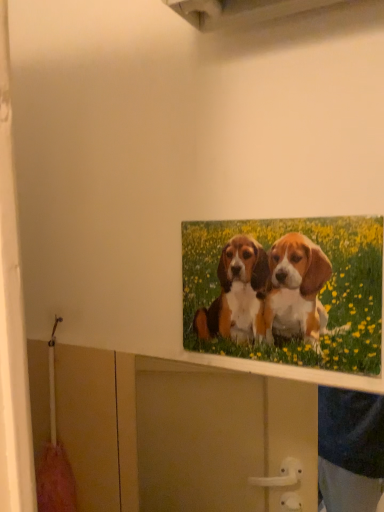
Question: Is matte white cabinet at upper center to the right of printed canvas puppies at upper center from the viewer's perspective?

Choices:
 (A) yes
 (B) no

Answer: (B)

Question: Is matte white cabinet at upper center positioned beyond the bounds of printed canvas puppies at upper center?

Choices:
 (A) no
 (B) yes

Answer: (B)

Question: From the image's perspective, is matte white cabinet at upper center under printed canvas puppies at upper center?

Choices:
 (A) yes
 (B) no

Answer: (A)

Question: Is matte white cabinet at upper center closer to camera compared to printed canvas puppies at upper center?

Choices:
 (A) yes
 (B) no

Answer: (A)

Question: Is matte white cabinet at upper center further to the viewer compared to printed canvas puppies at upper center?

Choices:
 (A) yes
 (B) no

Answer: (B)

Question: Is matte white cabinet at upper center taller than printed canvas puppies at upper center?

Choices:
 (A) no
 (B) yes

Answer: (B)

Question: Is printed canvas puppies at upper center oriented towards matte white cabinet at upper center?

Choices:
 (A) no
 (B) yes

Answer: (A)

Question: From the image's perspective, is printed canvas puppies at upper center under matte white cabinet at upper center?

Choices:
 (A) no
 (B) yes

Answer: (A)

Question: Is printed canvas puppies at upper center to the left of matte white cabinet at upper center from the viewer's perspective?

Choices:
 (A) yes
 (B) no

Answer: (B)

Question: Is printed canvas puppies at upper center to the right of matte white cabinet at upper center from the viewer's perspective?

Choices:
 (A) yes
 (B) no

Answer: (A)

Question: Considering the relative positions of printed canvas puppies at upper center and matte white cabinet at upper center in the image provided, is printed canvas puppies at upper center in front of matte white cabinet at upper center?

Choices:
 (A) yes
 (B) no

Answer: (B)

Question: Is printed canvas puppies at upper center shorter than matte white cabinet at upper center?

Choices:
 (A) no
 (B) yes

Answer: (B)

Question: Is printed canvas puppies at upper center inside the boundaries of matte white cabinet at upper center, or outside?

Choices:
 (A) inside
 (B) outside

Answer: (B)